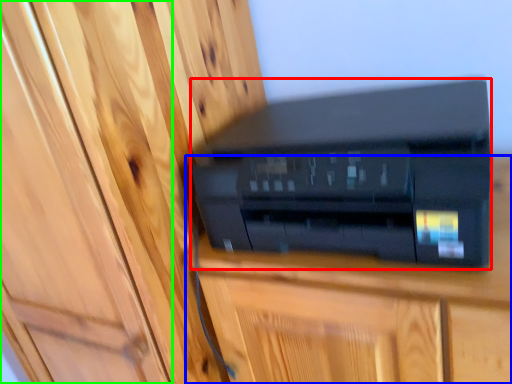
Question: Based on their relative distances, which object is farther from printer (highlighted by a red box)? Choose from furniture (highlighted by a blue box) and door (highlighted by a green box).

Choices:
 (A) furniture
 (B) door

Answer: (B)